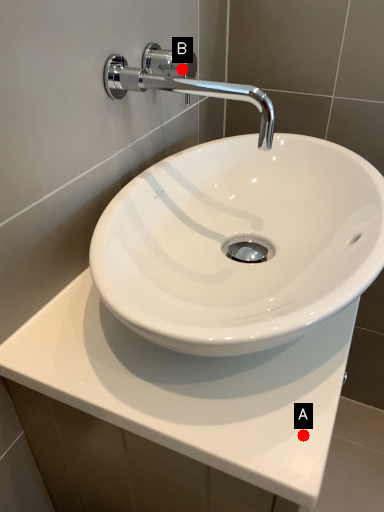
Question: Two points are circled on the image, labeled by A and B beside each circle. Which point is farther to the camera?

Choices:
 (A) A is further
 (B) B is further

Answer: (B)